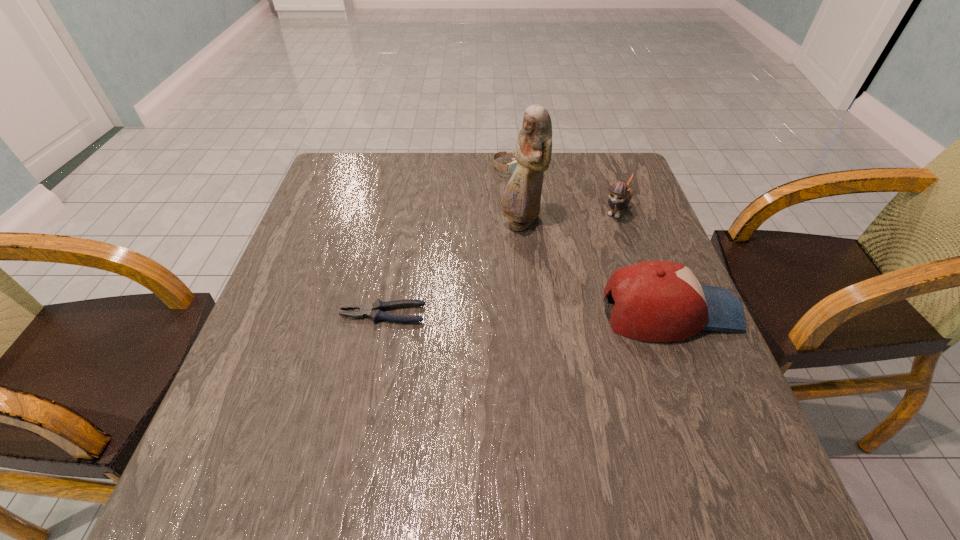
Locate an element on the screen. blank space that satisfies the following two spatial constraints: 1. on the back side of the tallest object; 2. on the left side of the kitten is located at coordinates (518, 210).

Where is `vacant space that satisfies the following two spatial constraints: 1. on the front side of the watch; 2. on the left side of the kitten`? The height and width of the screenshot is (540, 960). vacant space that satisfies the following two spatial constraints: 1. on the front side of the watch; 2. on the left side of the kitten is located at coordinates (518, 210).

The width and height of the screenshot is (960, 540). In order to click on free space in the image that satisfies the following two spatial constraints: 1. on the front side of the kitten; 2. on the front-facing side of the baseball cap in this screenshot , I will do point(652,312).